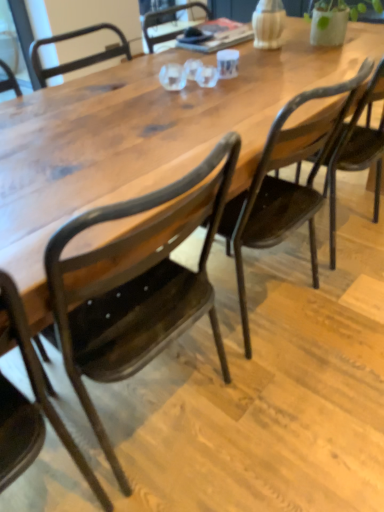
Describe the element at coordinates (29, 405) in the screenshot. I see `metallic dark brown chair at lower left, which is the 1th chair in left-to-right order` at that location.

I want to click on metallic dark brown chair at lower left, which appears as the 3th chair when viewed from the right, so click(29, 405).

Is metallic dark brown chair at lower left, which appears as the 3th chair when viewed from the right, turned away from matte dark wood chair at center, which appears as the 1th chair when viewed from the right?

No.

Is metallic dark brown chair at lower left, which is the 1th chair in left-to-right order, far from matte dark wood chair at center, which appears as the 1th chair when viewed from the right?

No.

Can you confirm if metallic dark brown chair at lower left, which is the 1th chair in left-to-right order, is taller than matte dark wood chair at center, which ranks as the third chair in left-to-right order?

Correct, metallic dark brown chair at lower left, which is the 1th chair in left-to-right order, is much taller as matte dark wood chair at center, which ranks as the third chair in left-to-right order.

You are a GUI agent. You are given a task and a screenshot of the screen. Output one action in this format:
    pyautogui.click(x=<x>, y=<y>)
    Task: Click on the 2nd chair to the left of the matte dark wood chair at center, which ranks as the third chair in left-to-right order, counting from the anchor's position
    This screenshot has width=384, height=512.
    Given the screenshot: What is the action you would take?
    pyautogui.click(x=29, y=405)

Relative to metallic dark brown chair at lower left, which is the 1th chair in left-to-right order, is matte dark wood chair at center, which appears as the 1th chair when viewed from the right, in front or behind?

matte dark wood chair at center, which appears as the 1th chair when viewed from the right, is positioned farther from the viewer than metallic dark brown chair at lower left, which is the 1th chair in left-to-right order.

Is matte dark wood chair at center, which ranks as the third chair in left-to-right order, smaller than metallic dark brown chair at lower left, which is the 1th chair in left-to-right order?

Actually, matte dark wood chair at center, which ranks as the third chair in left-to-right order, might be larger than metallic dark brown chair at lower left, which is the 1th chair in left-to-right order.

Between point (333, 97) and point (63, 444), which one is positioned behind?

Positioned behind is point (63, 444).

Does matte dark wood chair at center, which appears as the 1th chair when viewed from the right, have a greater width compared to matte black chair at center, which appears as the second chair when viewed from the left?

Yes.

Do you think matte dark wood chair at center, which appears as the 1th chair when viewed from the right, is within matte black chair at center, which is the second chair from right to left, or outside of it?

matte dark wood chair at center, which appears as the 1th chair when viewed from the right, lies outside matte black chair at center, which is the second chair from right to left.

At what (x,y) coordinates should I click in order to perform the action: click on chair lying above the matte black chair at center, which appears as the second chair when viewed from the left (from the image's perspective). Please return your answer as a coordinate pair (x, y). Looking at the image, I should click on click(286, 181).

Is matte dark wood chair at center, which appears as the 1th chair when viewed from the right, bigger than matte black chair at center, which appears as the second chair when viewed from the left?

Incorrect, matte dark wood chair at center, which appears as the 1th chair when viewed from the right, is not larger than matte black chair at center, which appears as the second chair when viewed from the left.

Consider the image. From the image's perspective, does metallic dark brown chair at lower left, which is the 1th chair in left-to-right order, appear higher than matte black chair at center, which is the second chair from right to left?

No, from the image's perspective, metallic dark brown chair at lower left, which is the 1th chair in left-to-right order, is not over matte black chair at center, which is the second chair from right to left.

Is metallic dark brown chair at lower left, which appears as the 3th chair when viewed from the right, taller or shorter than matte black chair at center, which appears as the second chair when viewed from the left?

Clearly, metallic dark brown chair at lower left, which appears as the 3th chair when viewed from the right, is taller compared to matte black chair at center, which appears as the second chair when viewed from the left.

What's the angular difference between metallic dark brown chair at lower left, which is the 1th chair in left-to-right order, and matte black chair at center, which is the second chair from right to left,'s facing directions?

There is a 0.00108-degree angle between the facing directions of metallic dark brown chair at lower left, which is the 1th chair in left-to-right order, and matte black chair at center, which is the second chair from right to left.

Could you measure the distance between metallic dark brown chair at lower left, which is the 1th chair in left-to-right order, and matte black chair at center, which is the second chair from right to left?

metallic dark brown chair at lower left, which is the 1th chair in left-to-right order, and matte black chair at center, which is the second chair from right to left, are 10.81 inches apart from each other.

Measure the distance between matte black chair at center, which appears as the second chair when viewed from the left, and metallic dark brown chair at lower left, which is the 1th chair in left-to-right order.

The distance of matte black chair at center, which appears as the second chair when viewed from the left, from metallic dark brown chair at lower left, which is the 1th chair in left-to-right order, is 10.81 inches.

Is matte black chair at center, which appears as the second chair when viewed from the left, oriented towards metallic dark brown chair at lower left, which appears as the 3th chair when viewed from the right?

No, matte black chair at center, which appears as the second chair when viewed from the left, is not aimed at metallic dark brown chair at lower left, which appears as the 3th chair when viewed from the right.

Is matte black chair at center, which is the second chair from right to left, far from metallic dark brown chair at lower left, which appears as the 3th chair when viewed from the right?

They are positioned close to each other.

Considering the positions of points (174, 293) and (102, 498), is point (174, 293) farther from camera compared to point (102, 498)?

No, it is in front of (102, 498).

How far apart are matte black chair at center, which is the second chair from right to left, and matte dark wood chair at center, which appears as the 1th chair when viewed from the right?

matte black chair at center, which is the second chair from right to left, is 14.20 inches away from matte dark wood chair at center, which appears as the 1th chair when viewed from the right.

Can you confirm if matte black chair at center, which is the second chair from right to left, is bigger than matte dark wood chair at center, which appears as the 1th chair when viewed from the right?

Correct, matte black chair at center, which is the second chair from right to left, is larger in size than matte dark wood chair at center, which appears as the 1th chair when viewed from the right.

From a real-world perspective, between matte black chair at center, which is the second chair from right to left, and matte dark wood chair at center, which ranks as the third chair in left-to-right order, who is vertically higher?

matte black chair at center, which is the second chair from right to left.

Considering the sizes of objects matte black chair at center, which appears as the second chair when viewed from the left, and matte dark wood chair at center, which ranks as the third chair in left-to-right order, in the image provided, who is taller, matte black chair at center, which appears as the second chair when viewed from the left, or matte dark wood chair at center, which ranks as the third chair in left-to-right order,?

With more height is matte black chair at center, which appears as the second chair when viewed from the left.

From the image's perspective, which chair is the 2nd one above the metallic dark brown chair at lower left, which is the 1th chair in left-to-right order? Please provide its 2D coordinates.

[(286, 181)]

The height and width of the screenshot is (512, 384). Find the location of `chair that is the 2nd object located in front of the matte dark wood chair at center, which appears as the 1th chair when viewed from the right`. chair that is the 2nd object located in front of the matte dark wood chair at center, which appears as the 1th chair when viewed from the right is located at coordinates (29, 405).

Looking at the image, which one is located closer to matte dark wood chair at center, which appears as the 1th chair when viewed from the right, matte black chair at center, which appears as the second chair when viewed from the left, or metallic dark brown chair at lower left, which is the 1th chair in left-to-right order?

Based on the image, matte black chair at center, which appears as the second chair when viewed from the left, appears to be nearer to matte dark wood chair at center, which appears as the 1th chair when viewed from the right.

Which object lies nearer to the anchor point matte black chair at center, which is the second chair from right to left, matte dark wood chair at center, which appears as the 1th chair when viewed from the right, or metallic dark brown chair at lower left, which is the 1th chair in left-to-right order?

Among the two, metallic dark brown chair at lower left, which is the 1th chair in left-to-right order, is located nearer to matte black chair at center, which is the second chair from right to left.

In the scene shown: When comparing their distances from metallic dark brown chair at lower left, which appears as the 3th chair when viewed from the right, does matte dark wood chair at center, which appears as the 1th chair when viewed from the right, or matte black chair at center, which appears as the second chair when viewed from the left, seem further?

matte dark wood chair at center, which appears as the 1th chair when viewed from the right, is further to metallic dark brown chair at lower left, which appears as the 3th chair when viewed from the right.

Based on their spatial positions, is metallic dark brown chair at lower left, which is the 1th chair in left-to-right order, or matte black chair at center, which appears as the second chair when viewed from the left, further from matte dark wood chair at center, which ranks as the third chair in left-to-right order?

Among the two, metallic dark brown chair at lower left, which is the 1th chair in left-to-right order, is located further to matte dark wood chair at center, which ranks as the third chair in left-to-right order.

Which object lies further to the anchor point metallic dark brown chair at lower left, which appears as the 3th chair when viewed from the right, matte black chair at center, which appears as the second chair when viewed from the left, or matte dark wood chair at center, which appears as the 1th chair when viewed from the right?

matte dark wood chair at center, which appears as the 1th chair when viewed from the right, lies further to metallic dark brown chair at lower left, which appears as the 3th chair when viewed from the right, than the other object.

Estimate the real-world distances between objects in this image. Which object is further from matte black chair at center, which appears as the second chair when viewed from the left, metallic dark brown chair at lower left, which is the 1th chair in left-to-right order, or matte dark wood chair at center, which appears as the 1th chair when viewed from the right?

matte dark wood chair at center, which appears as the 1th chair when viewed from the right, lies further to matte black chair at center, which appears as the second chair when viewed from the left, than the other object.

Where is `chair between metallic dark brown chair at lower left, which is the 1th chair in left-to-right order, and matte dark wood chair at center, which ranks as the third chair in left-to-right order, in the horizontal direction`? The width and height of the screenshot is (384, 512). chair between metallic dark brown chair at lower left, which is the 1th chair in left-to-right order, and matte dark wood chair at center, which ranks as the third chair in left-to-right order, in the horizontal direction is located at coordinates (137, 287).